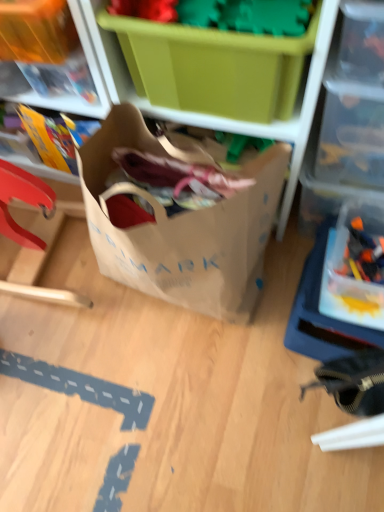
Describe the element at coordinates (36, 31) in the screenshot. This screenshot has height=512, width=384. I see `matte plastic storage box at upper left, the 1th storage box when ordered from left to right` at that location.

Image resolution: width=384 pixels, height=512 pixels. Describe the element at coordinates (213, 67) in the screenshot. I see `green plastic storage box at upper center, acting as the second storage box starting from the left` at that location.

This screenshot has width=384, height=512. Identify the location of green plastic storage box at upper center, acting as the second storage box starting from the left. (213, 67).

Measure the distance between translucent plastic toy at right and camera.

They are 36.57 inches apart.

Where is `matte plastic storage box at upper left, the 1th storage box when ordered from left to right`? The width and height of the screenshot is (384, 512). matte plastic storage box at upper left, the 1th storage box when ordered from left to right is located at coordinates (36, 31).

I want to click on the 2nd storage box to the right of the matte plastic storage box at upper left, the 1th storage box when ordered from left to right, counting from the anchor's position, so coord(355,266).

From a real-world perspective, relative to transparent plastic storage box at right, which appears as the 3th storage box when viewed from the left, is matte plastic storage box at upper left, the 1th storage box when ordered from left to right, vertically above or below?

matte plastic storage box at upper left, the 1th storage box when ordered from left to right, is situated higher than transparent plastic storage box at right, which appears as the 3th storage box when viewed from the left, in the real world.

Can you confirm if matte plastic storage box at upper left, which appears as the third storage box when viewed from the right, is positioned to the right of transparent plastic storage box at right, which appears as the 3th storage box when viewed from the left?

No, matte plastic storage box at upper left, which appears as the third storage box when viewed from the right, is not to the right of transparent plastic storage box at right, which appears as the 3th storage box when viewed from the left.

Between brown paper bag at center and transparent plastic storage box at right, which appears as the 1th storage box when viewed from the right, which one has smaller size?

transparent plastic storage box at right, which appears as the 1th storage box when viewed from the right.

From the image's perspective, is brown paper bag at center located above or below transparent plastic storage box at right, which appears as the 1th storage box when viewed from the right?

From the image's perspective, brown paper bag at center appears above transparent plastic storage box at right, which appears as the 1th storage box when viewed from the right.

Is brown paper bag at center facing towards transparent plastic storage box at right, which appears as the 1th storage box when viewed from the right?

No, brown paper bag at center is not aimed at transparent plastic storage box at right, which appears as the 1th storage box when viewed from the right.

How many degrees apart are the facing directions of brown paper bag at center and transparent plastic storage box at right, which appears as the 3th storage box when viewed from the left?

brown paper bag at center and transparent plastic storage box at right, which appears as the 3th storage box when viewed from the left, are facing 0.904 degrees away from each other.

Can you confirm if translucent plastic toy at right is taller than transparent plastic storage box at right, which appears as the 3th storage box when viewed from the left?

Incorrect, the height of translucent plastic toy at right is not larger of that of transparent plastic storage box at right, which appears as the 3th storage box when viewed from the left.

Could you tell me if translucent plastic toy at right is turned towards transparent plastic storage box at right, which appears as the 3th storage box when viewed from the left?

Yes, translucent plastic toy at right is facing transparent plastic storage box at right, which appears as the 3th storage box when viewed from the left.

Between translucent plastic toy at right and transparent plastic storage box at right, which appears as the 1th storage box when viewed from the right, which one has larger size?

transparent plastic storage box at right, which appears as the 1th storage box when viewed from the right, is bigger.

Can you tell me how much translucent plastic toy at right and transparent plastic storage box at right, which appears as the 3th storage box when viewed from the left, differ in facing direction?

The angular difference between translucent plastic toy at right and transparent plastic storage box at right, which appears as the 3th storage box when viewed from the left, is 0.00185 degrees.

Is point (374, 292) more distant than point (176, 199)?

No, it is not.

From the image's perspective, is transparent plastic storage box at right, which appears as the 1th storage box when viewed from the right, located above or below brown paper bag at center?

transparent plastic storage box at right, which appears as the 1th storage box when viewed from the right, is below brown paper bag at center.

Which object is further away from the camera taking this photo, transparent plastic storage box at right, which appears as the 1th storage box when viewed from the right, or brown paper bag at center?

transparent plastic storage box at right, which appears as the 1th storage box when viewed from the right, is behind.

Is transparent plastic storage box at right, which appears as the 3th storage box when viewed from the left, next to brown paper bag at center and touching it?

No, transparent plastic storage box at right, which appears as the 3th storage box when viewed from the left, is not beside brown paper bag at center.

Which is more to the right, translucent plastic toy at right or green plastic storage box at upper center, acting as the second storage box starting from the left?

From the viewer's perspective, translucent plastic toy at right appears more on the right side.

From a real-world perspective, count 2nd storage boxs upward from the translucent plastic toy at right and point to it. Please provide its 2D coordinates.

[(213, 67)]

Which of these two, translucent plastic toy at right or green plastic storage box at upper center, acting as the second storage box starting from the left, is wider?

green plastic storage box at upper center, acting as the second storage box starting from the left, is wider.

Who is taller, translucent plastic toy at right or green plastic storage box at upper center, the 2th storage box when ordered from right to left?

green plastic storage box at upper center, the 2th storage box when ordered from right to left.

Which is more to the left, matte plastic storage box at upper left, which appears as the third storage box when viewed from the right, or translucent plastic toy at right?

matte plastic storage box at upper left, which appears as the third storage box when viewed from the right, is more to the left.

From the image's perspective, between matte plastic storage box at upper left, the 1th storage box when ordered from left to right, and translucent plastic toy at right, who is located below?

translucent plastic toy at right is shown below in the image.

From a real-world perspective, does matte plastic storage box at upper left, the 1th storage box when ordered from left to right, stand above translucent plastic toy at right?

Yes, from a real-world perspective, matte plastic storage box at upper left, the 1th storage box when ordered from left to right, is over translucent plastic toy at right

Which object is thinner, matte plastic storage box at upper left, which appears as the third storage box when viewed from the right, or translucent plastic toy at right?

translucent plastic toy at right.

Which of these two, transparent plastic container at upper right or translucent plastic toy at right, is thinner?

With smaller width is translucent plastic toy at right.

Considering the sizes of transparent plastic container at upper right and translucent plastic toy at right in the image, is transparent plastic container at upper right bigger or smaller than translucent plastic toy at right?

Considering their sizes, transparent plastic container at upper right takes up more space than translucent plastic toy at right.

Looking at this image, from a real-world perspective, is transparent plastic container at upper right positioned over translucent plastic toy at right based on gravity?

Yes, from a real-world perspective, transparent plastic container at upper right is above translucent plastic toy at right.

Which is behind, point (334, 152) or point (372, 265)?

The point (372, 265) is more distant.

I want to click on the 2nd storage box above the transparent plastic storage box at right, which appears as the 1th storage box when viewed from the right (from the image's perspective), so click(x=36, y=31).

There is a transparent plastic storage box at right, which appears as the 1th storage box when viewed from the right. In order to click on bag above it (from a real-world perspective) in this screenshot , I will do `click(179, 214)`.

From the image, which object appears to be farther from transparent plastic storage box at right, which appears as the 3th storage box when viewed from the left, green plastic storage box at upper center, acting as the second storage box starting from the left, or brown paper bag at center?

Based on the image, green plastic storage box at upper center, acting as the second storage box starting from the left, appears to be further to transparent plastic storage box at right, which appears as the 3th storage box when viewed from the left.

Considering their positions, is translucent plastic toy at right positioned further to transparent plastic storage box at right, which appears as the 3th storage box when viewed from the left, than brown paper bag at center?

brown paper bag at center.

Which object lies further to the anchor point green plastic storage box at upper center, the 2th storage box when ordered from right to left, transparent plastic container at upper right or brown paper bag at center?

The object further to green plastic storage box at upper center, the 2th storage box when ordered from right to left, is brown paper bag at center.

When comparing their distances from transparent plastic storage box at right, which appears as the 3th storage box when viewed from the left, does green plastic storage box at upper center, acting as the second storage box starting from the left, or translucent plastic toy at right seem further?

green plastic storage box at upper center, acting as the second storage box starting from the left, is positioned further to the anchor transparent plastic storage box at right, which appears as the 3th storage box when viewed from the left.

Looking at the image, which one is located closer to transparent plastic container at upper right, matte plastic storage box at upper left, which appears as the third storage box when viewed from the right, or translucent plastic toy at right?

translucent plastic toy at right is closer to transparent plastic container at upper right.

Based on their spatial positions, is transparent plastic container at upper right or matte plastic storage box at upper left, which appears as the third storage box when viewed from the right, closer to brown paper bag at center?

transparent plastic container at upper right is closer to brown paper bag at center.

Considering their positions, is translucent plastic toy at right positioned further to matte plastic storage box at upper left, which appears as the third storage box when viewed from the right, than transparent plastic storage box at right, which appears as the 1th storage box when viewed from the right?

Based on the image, translucent plastic toy at right appears to be further to matte plastic storage box at upper left, which appears as the third storage box when viewed from the right.

Considering their positions, is translucent plastic toy at right positioned closer to green plastic storage box at upper center, the 2th storage box when ordered from right to left, than transparent plastic container at upper right?

transparent plastic container at upper right is closer to green plastic storage box at upper center, the 2th storage box when ordered from right to left.

What are the coordinates of `storage box that lies between matte plastic storage box at upper left, which appears as the third storage box when viewed from the right, and brown paper bag at center from top to bottom` in the screenshot? It's located at (213, 67).

You are a GUI agent. You are given a task and a screenshot of the screen. Output one action in this format:
    pyautogui.click(x=<x>, y=<y>)
    Task: Click on the shelf situated between matte plastic storage box at upper left, the 1th storage box when ordered from left to right, and transparent plastic storage box at right, which appears as the 3th storage box when viewed from the left, from left to right
    
    Given the screenshot: What is the action you would take?
    pyautogui.click(x=347, y=116)

Identify the location of shelf between green plastic storage box at upper center, acting as the second storage box starting from the left, and transparent plastic storage box at right, which appears as the 3th storage box when viewed from the left, from top to bottom. The height and width of the screenshot is (512, 384). (347, 116).

This screenshot has width=384, height=512. Identify the location of shelf between green plastic storage box at upper center, acting as the second storage box starting from the left, and translucent plastic toy at right, in the vertical direction. (347, 116).